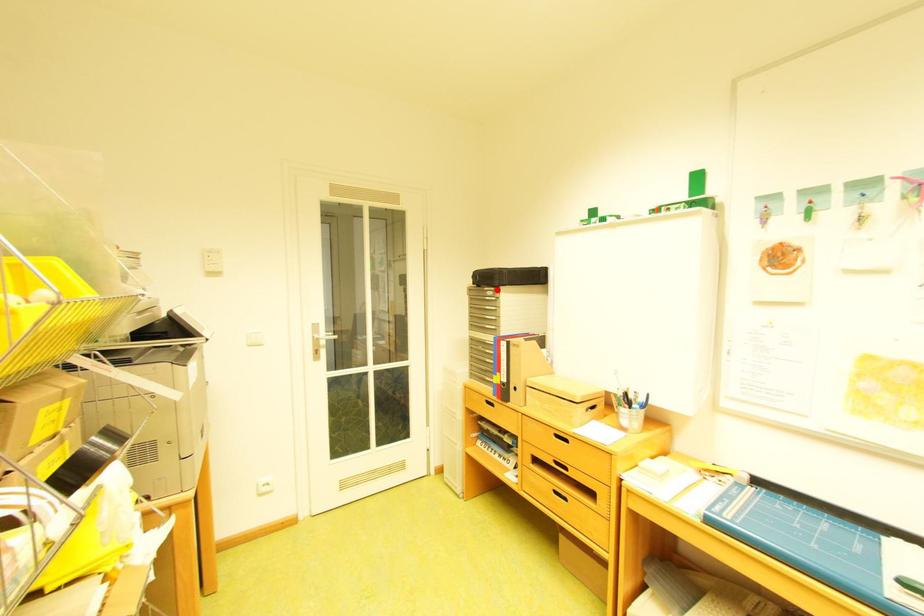
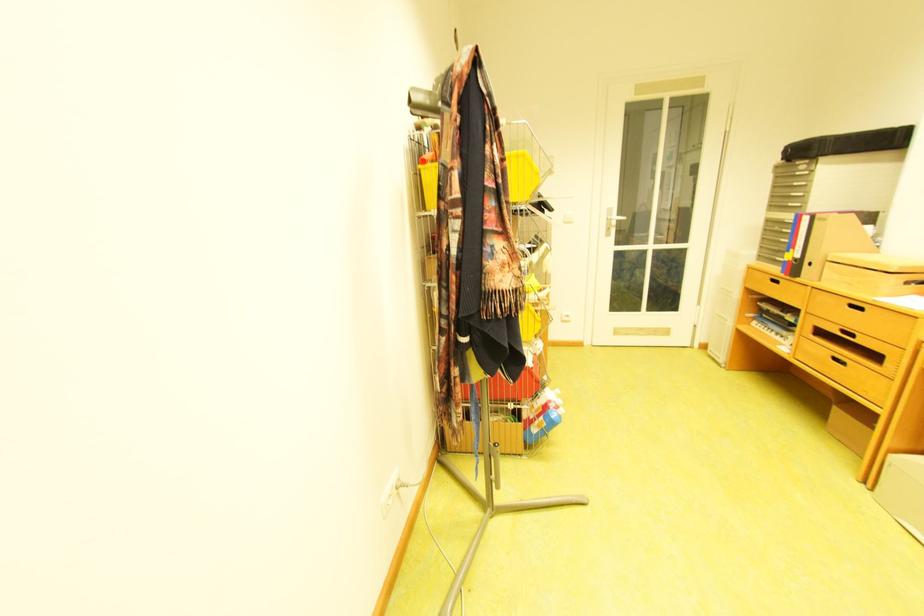
Question: I am providing you with two images of the same scene from different viewpoints. A red point is shown in image1. For the corresponding object point in image2, is it positioned nearer or farther from the camera?

Choices:
 (A) Nearer
 (B) Farther

Answer: (B)